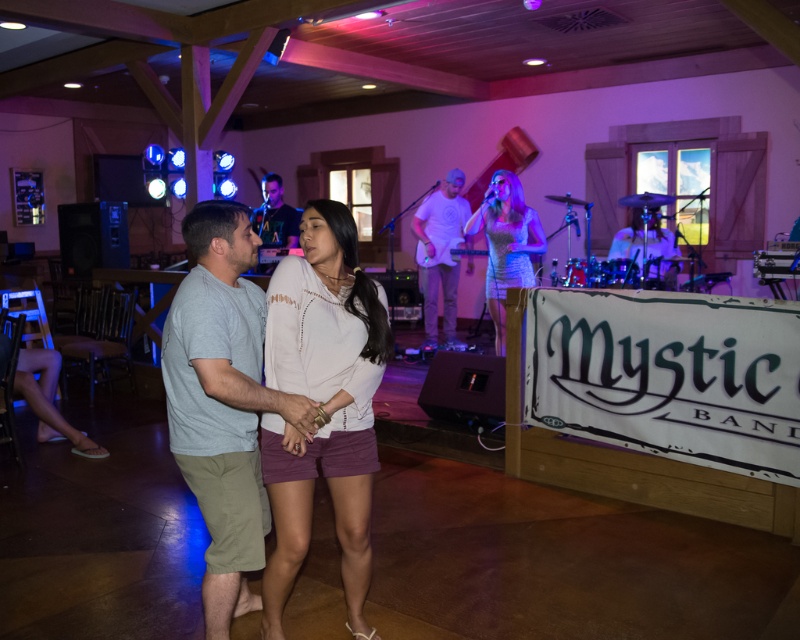
You are a photographer at the event and need to capture both the shiny silver dress at center and the matte black shirt at center in a single frame. Given their sizes, which object should you focus on to ensure both are clearly visible?

Since the shiny silver dress at center occupies less space than the matte black shirt at center, you should focus on the matte black shirt at center as it is larger and will require more attention to capture details, while the smaller shiny silver dress at center will naturally fit into the frame without needing as much focus adjustment.

You are a photographer at the event and want to capture a photo of the two shirts mentioned. Given that the white matte shirt at center is taller than the matte black shirt at center, which one should you focus on to ensure both shirts are fully visible in the frame?

Since the white matte shirt at center is taller than the matte black shirt at center, focusing on the white matte shirt at center ensures that both shirts are fully visible in the frame as it is the taller one.